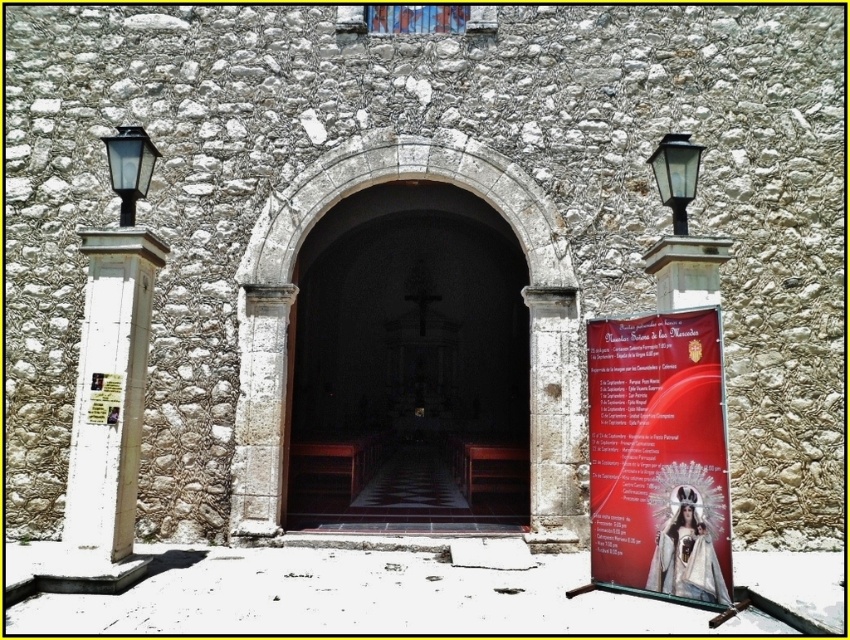
Question: Which object is farther from the camera taking this photo?

Choices:
 (A) black glass lamp at upper right
 (B) white stone door at left
 (C) dark wood door at center

Answer: (C)

Question: Where is white stone door at left located in relation to matte red poster at right in the image?

Choices:
 (A) left
 (B) right

Answer: (B)

Question: Is white stone door at left smaller than black glass lamp at left?

Choices:
 (A) yes
 (B) no

Answer: (B)

Question: Can you confirm if dark wood door at center is wider than matte red poster at right?

Choices:
 (A) yes
 (B) no

Answer: (A)

Question: Which point is closer to the camera?

Choices:
 (A) (110, 397)
 (B) (139, 376)

Answer: (A)

Question: Estimate the real-world distances between objects in this image. Which object is closer to the red glossy poster at right?

Choices:
 (A) dark wood door at center
 (B) matte red poster at right
 (C) white stone door at left

Answer: (C)